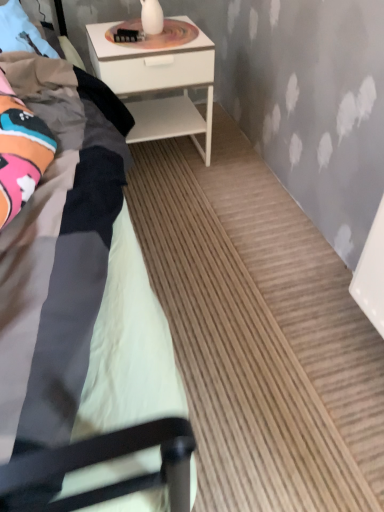
At what (x,y) coordinates should I click in order to perform the action: click on vacant area that is situated to the right of white glossy nightstand at upper center. Please return your answer as a coordinate pair (x, y). Image resolution: width=384 pixels, height=512 pixels. Looking at the image, I should click on (235, 160).